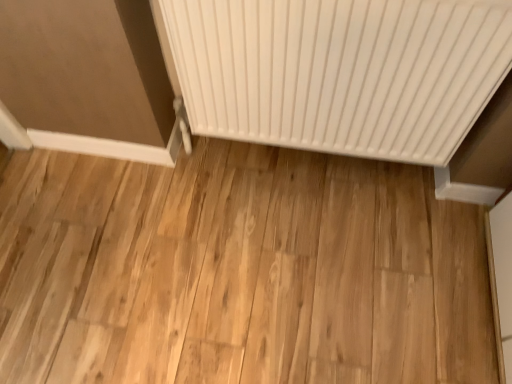
You are a GUI agent. You are given a task and a screenshot of the screen. Output one action in this format:
    pyautogui.click(x=<x>, y=<y>)
    Task: Click on the white ribbed radiator at center
    This screenshot has width=512, height=384.
    Given the screenshot: What is the action you would take?
    pyautogui.click(x=341, y=71)

What do you see at coordinates (341, 71) in the screenshot?
I see `white ribbed radiator at center` at bounding box center [341, 71].

The height and width of the screenshot is (384, 512). I want to click on white ribbed radiator at center, so click(x=341, y=71).